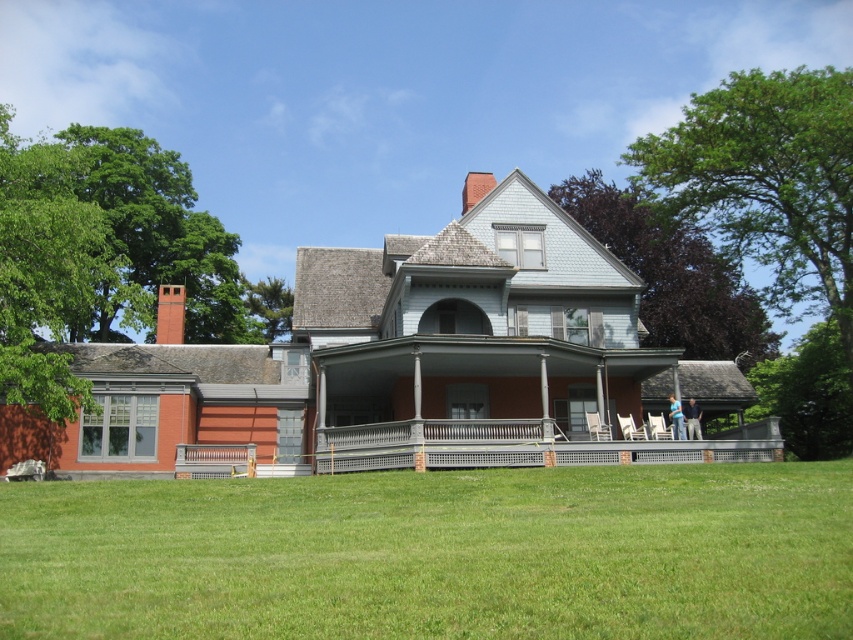
Question: Which object appears closest to the camera in this image?

Choices:
 (A) blue jeans at center
 (B) gray wooden porch at center

Answer: (B)

Question: Which object is farther from the camera taking this photo?

Choices:
 (A) blue jeans at center
 (B) gray wooden porch at center
 (C) blue fabric shirt at lower right

Answer: (A)

Question: Can you confirm if green grass at lower center is positioned below blue jeans at center?

Choices:
 (A) yes
 (B) no

Answer: (A)

Question: Among these points, which one is farthest from the camera?

Choices:
 (A) (482, 444)
 (B) (401, 492)
 (C) (679, 426)
 (D) (686, 428)

Answer: (D)

Question: Can you confirm if gray wooden porch at center is positioned below blue jeans at center?

Choices:
 (A) no
 (B) yes

Answer: (B)

Question: Is blue jeans at center in front of blue fabric shirt at lower right?

Choices:
 (A) yes
 (B) no

Answer: (B)